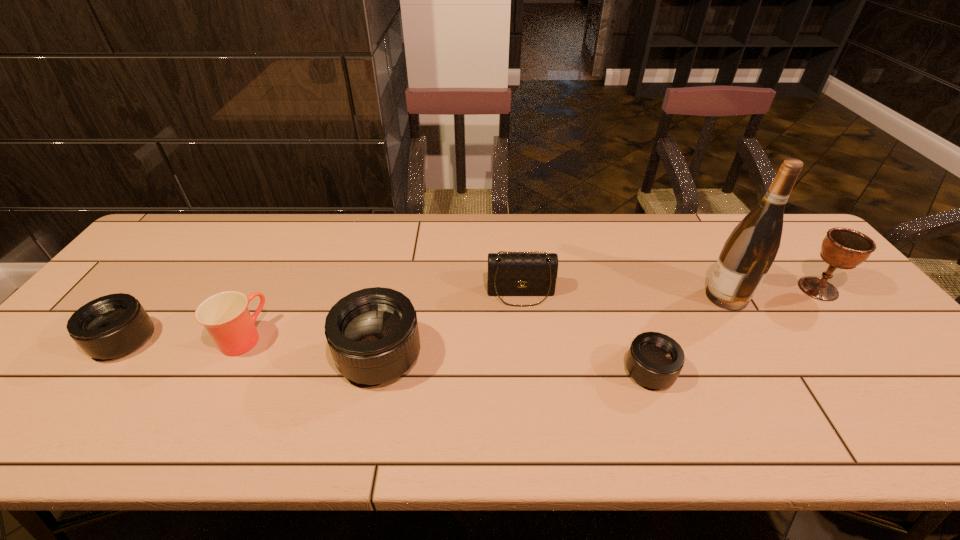
Image resolution: width=960 pixels, height=540 pixels. In order to click on the leftmost object in this screenshot , I will do `click(111, 326)`.

Where is `the leftmost telephoto lens`? This screenshot has width=960, height=540. the leftmost telephoto lens is located at coordinates (111, 326).

You are a GUI agent. You are given a task and a screenshot of the screen. Output one action in this format:
    pyautogui.click(x=<x>, y=<y>)
    Task: Click on the tallest telephoto lens
    Image resolution: width=960 pixels, height=540 pixels.
    Given the screenshot: What is the action you would take?
    pyautogui.click(x=372, y=333)

The image size is (960, 540). I want to click on the second telephoto lens from right to left, so click(372, 333).

Where is `the third object from right to left`? the third object from right to left is located at coordinates (655, 360).

Where is `the rightmost telephoto lens`? the rightmost telephoto lens is located at coordinates (655, 360).

Find the location of `clutch bag`. clutch bag is located at coordinates (509, 273).

What are the coordinates of `the sixth object from left to right` in the screenshot? It's located at (747, 255).

Identify the location of the tallest object. The height and width of the screenshot is (540, 960). (747, 255).

Where is `chalice`? chalice is located at coordinates (843, 248).